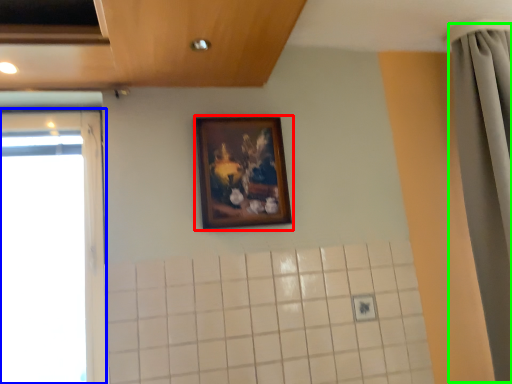
Question: Which object is positioned farthest from picture frame (highlighted by a red box)? Select from window (highlighted by a blue box) and shower curtain (highlighted by a green box).

Choices:
 (A) window
 (B) shower curtain

Answer: (B)